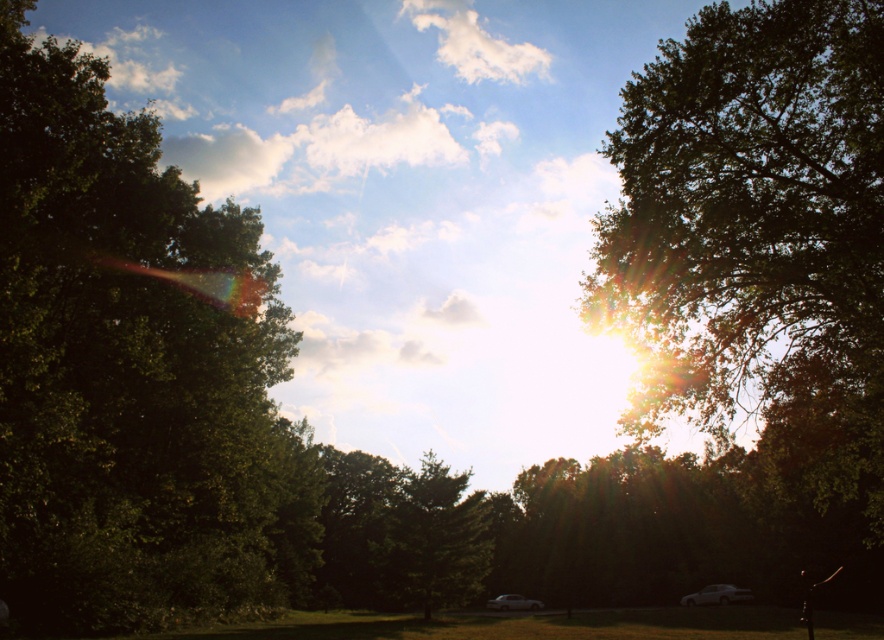
You are standing in the middle of the path and see the point marked at coordinates point (x=133, y=371). What object is located at that point?

The point (x=133, y=371) corresponds to the green leafy tree at left.

You are a bird flying towards the sun in this scene. Which tree, the green leafy tree at upper right or the green matte tree at center, would you encounter first?

The green leafy tree at upper right is in front of the green matte tree at center, so you would encounter the green leafy tree at upper right first.

You are a bird looking for a place to perch. You see the green leafy tree at upper right and the green matte tree at center. Which tree would you choose if you prefer a larger tree to rest on?

The green leafy tree at upper right is bigger than the green matte tree at center, so the bird should choose the green leafy tree at upper right.